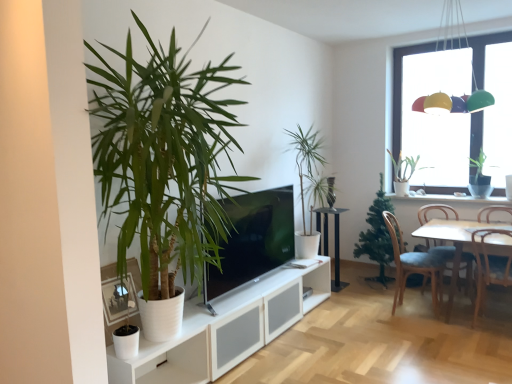
The width and height of the screenshot is (512, 384). Find the location of `transparent glass window at upper right`. transparent glass window at upper right is located at coordinates (440, 119).

Locate an element on the screen. The image size is (512, 384). green matte christmas tree at center, which ranks as the 3th houseplant in right-to-left order is located at coordinates (377, 236).

What is the approximate height of green matte christmas tree at center, placed as the 2th houseplant when sorted from back to front?

green matte christmas tree at center, placed as the 2th houseplant when sorted from back to front, is 1.22 meters tall.

What is the approximate width of blue fabric chair at lower right, which is the fourth chair from right to left?

blue fabric chair at lower right, which is the fourth chair from right to left, is 20.95 inches wide.

The image size is (512, 384). I want to click on green matte plant at upper right, which is counted as the first houseplant, starting from the right, so click(x=479, y=178).

Where is `white wooden table at right, which is the first table from right to left`? The image size is (512, 384). white wooden table at right, which is the first table from right to left is located at coordinates (454, 242).

From the image's perspective, does green matte plant at upper right, positioned as the fourth houseplant in left-to-right order, appear higher than multicolored plastic lampshade at upper right?

No.

Is point (396, 170) farther from camera compared to point (467, 101)?

Yes, point (396, 170) is behind point (467, 101).

Is green matte plant at upper right, the first houseplant when ordered from back to front, to the right of multicolored plastic lampshade at upper right from the viewer's perspective?

Indeed, green matte plant at upper right, the first houseplant when ordered from back to front, is positioned on the right side of multicolored plastic lampshade at upper right.

Considering the sizes of green matte plant at upper right, positioned as the second houseplant in right-to-left order, and multicolored plastic lampshade at upper right in the image, is green matte plant at upper right, positioned as the second houseplant in right-to-left order, wider or thinner than multicolored plastic lampshade at upper right?

Considering their sizes, green matte plant at upper right, positioned as the second houseplant in right-to-left order, looks slimmer than multicolored plastic lampshade at upper right.

From the image's perspective, does black metal table at center, the 1th table viewed from the back, appear lower than wooden chair at lower right, positioned as the 3th chair in left-to-right order?

No.

In terms of width, does black metal table at center, which appears as the 2th table when viewed from the front, look wider or thinner when compared to wooden chair at lower right, positioned as the 3th chair in left-to-right order?

Clearly, black metal table at center, which appears as the 2th table when viewed from the front, has less width compared to wooden chair at lower right, positioned as the 3th chair in left-to-right order.

How much distance is there between black metal table at center, the 1th table viewed from the back, and wooden chair at lower right, positioned as the 3th chair in left-to-right order?

The distance of black metal table at center, the 1th table viewed from the back, from wooden chair at lower right, positioned as the 3th chair in left-to-right order, is 1.38 meters.

Consider the image. Considering their positions, is black metal table at center, placed as the second table when sorted from right to left, located in front of or behind wooden chair at lower right, positioned as the 3th chair in left-to-right order?

black metal table at center, placed as the second table when sorted from right to left, is positioned farther from the viewer than wooden chair at lower right, positioned as the 3th chair in left-to-right order.

Is white wooden table at right, marked as the second table in a back-to-front arrangement, aimed at green leafy plant at center, arranged as the fourth houseplant when viewed from the back?

No, white wooden table at right, marked as the second table in a back-to-front arrangement, is not aimed at green leafy plant at center, arranged as the fourth houseplant when viewed from the back.

Which object is further away from the camera, white wooden table at right, which is the first table from right to left, or green leafy plant at center, acting as the 2th houseplant starting from the front?

Positioned behind is green leafy plant at center, acting as the 2th houseplant starting from the front.

How distant is white wooden table at right, which is the second table from left to right, from green leafy plant at center, arranged as the fourth houseplant when viewed from the back?

white wooden table at right, which is the second table from left to right, is 4.05 feet from green leafy plant at center, arranged as the fourth houseplant when viewed from the back.

From a real-world perspective, which is physically below, white wooden table at right, which is the first table from right to left, or green leafy plant at center, which appears as the second houseplant when viewed from the left?

From a 3D spatial view, white wooden table at right, which is the first table from right to left, is below.

Is the surface of white wooden table at right, which is the 1th table in front-to-back order, in direct contact with white ceramic window sill at upper right?

white wooden table at right, which is the 1th table in front-to-back order, and white ceramic window sill at upper right are not in contact.

Is white wooden table at right, which is the first table from right to left, not within white ceramic window sill at upper right?

Yes, white wooden table at right, which is the first table from right to left, is outside of white ceramic window sill at upper right.

Which object is more forward, white wooden table at right, which is the second table from left to right, or white ceramic window sill at upper right?

white wooden table at right, which is the second table from left to right.

Is white wooden table at right, which is the 1th table in front-to-back order, bigger or smaller than white ceramic window sill at upper right?

In the image, white wooden table at right, which is the 1th table in front-to-back order, appears to be larger than white ceramic window sill at upper right.

From the image's perspective, is green leafy plant at left, which ranks as the 1th houseplant in left-to-right order, located above or below blue fabric chair at lower right, which is the fourth chair from right to left?

Clearly, from the image's perspective, green leafy plant at left, which ranks as the 1th houseplant in left-to-right order, is above blue fabric chair at lower right, which is the fourth chair from right to left.

Visually, is green leafy plant at left, which ranks as the 1th houseplant in left-to-right order, positioned to the left or to the right of blue fabric chair at lower right, which is the fourth chair from right to left?

green leafy plant at left, which ranks as the 1th houseplant in left-to-right order, is to the left of blue fabric chair at lower right, which is the fourth chair from right to left.

Which of these two, green leafy plant at left, the first houseplant when ordered from front to back, or blue fabric chair at lower right, which ranks as the 1th chair in left-to-right order, is smaller?

With smaller size is blue fabric chair at lower right, which ranks as the 1th chair in left-to-right order.

Considering the positions of points (175, 54) and (393, 243), is point (175, 54) farther from camera compared to point (393, 243)?

That is False.

Is point (488, 202) closer or farther from the camera than point (399, 192)?

Point (488, 202) is closer to the camera than point (399, 192).

Does white ceramic window sill at upper right lie behind green matte plant at upper right, positioned as the second houseplant in right-to-left order?

No.

How much distance is there between white ceramic window sill at upper right and green matte plant at upper right, which is the 5th houseplant in front-to-back order?

white ceramic window sill at upper right and green matte plant at upper right, which is the 5th houseplant in front-to-back order, are 16.60 inches apart.

From a real-world perspective, which object rests below the other?

From a 3D spatial view, white ceramic window sill at upper right is below.

Which of these two, blue fabric chair at lower right, which ranks as the 1th chair in left-to-right order, or wooden chair at right, acting as the third chair starting from the right, is bigger?

With larger size is blue fabric chair at lower right, which ranks as the 1th chair in left-to-right order.

Between blue fabric chair at lower right, which is the fourth chair from right to left, and wooden chair at right, which is the second chair from left to right, which one has less height?

Standing shorter between the two is wooden chair at right, which is the second chair from left to right.

Is blue fabric chair at lower right, which ranks as the 1th chair in left-to-right order, facing away from wooden chair at right, acting as the third chair starting from the right?

No.

From a real-world perspective, is blue fabric chair at lower right, which is the fourth chair from right to left, positioned under wooden chair at right, which is the second chair from left to right, based on gravity?

Yes, from a real-world perspective, blue fabric chair at lower right, which is the fourth chair from right to left, is under wooden chair at right, which is the second chair from left to right.

I want to click on the 4th houseplant behind when counting from the multicolored plastic lampshade at upper right, so click(404, 172).

The width and height of the screenshot is (512, 384). What are the coordinates of `the 4th chair in front of the black metal table at center, the 1th table viewed from the back` in the screenshot? It's located at (490, 265).

Looking at the image, which one is located closer to green matte christmas tree at center, which ranks as the 3th houseplant in right-to-left order, green leafy plant at center, acting as the 2th houseplant starting from the front, or green matte plant at upper right, placed as the 3th houseplant when sorted from front to back?

The object closer to green matte christmas tree at center, which ranks as the 3th houseplant in right-to-left order, is green leafy plant at center, acting as the 2th houseplant starting from the front.

From the image, which object appears to be farther from transparent glass window at upper right, green leafy plant at center, marked as the 4th houseplant in a right-to-left arrangement, or matte black tv at center?

Based on the image, matte black tv at center appears to be further to transparent glass window at upper right.

Looking at the image, which one is located closer to wooden chair at right, acting as the third chair starting from the right, green matte christmas tree at center, the 3th houseplant from the left, or transparent glass window at upper right?

The object closer to wooden chair at right, acting as the third chair starting from the right, is green matte christmas tree at center, the 3th houseplant from the left.

Considering their positions, is green leafy plant at left, which ranks as the 1th houseplant in left-to-right order, positioned further to wooden chair at right, acting as the third chair starting from the right, than transparent glass window at upper right?

green leafy plant at left, which ranks as the 1th houseplant in left-to-right order, is further to wooden chair at right, acting as the third chair starting from the right.

Looking at the image, which one is located further to green matte plant at upper right, marked as the third houseplant in a back-to-front arrangement, black metal table at center, placed as the second table when sorted from right to left, or blue fabric chair at lower right, which ranks as the 1th chair in left-to-right order?

black metal table at center, placed as the second table when sorted from right to left, is positioned further to the anchor green matte plant at upper right, marked as the third houseplant in a back-to-front arrangement.

From the image, which object appears to be nearer to white wooden table at right, which is the 1th table in front-to-back order, transparent glass window at upper right or green matte plant at upper right, which is the 5th houseplant in front-to-back order?

Based on the image, green matte plant at upper right, which is the 5th houseplant in front-to-back order, appears to be nearer to white wooden table at right, which is the 1th table in front-to-back order.

Based on their spatial positions, is green matte christmas tree at center, placed as the 2th houseplant when sorted from back to front, or transparent glass window at upper right closer to blue fabric chair at lower right, which ranks as the 1th chair in left-to-right order?

Among the two, green matte christmas tree at center, placed as the 2th houseplant when sorted from back to front, is located nearer to blue fabric chair at lower right, which ranks as the 1th chair in left-to-right order.

Which object lies nearer to the anchor point transparent glass window at upper right, green leafy plant at center, marked as the 4th houseplant in a right-to-left arrangement, or green matte plant at upper right, positioned as the 5th houseplant in left-to-right order?

green matte plant at upper right, positioned as the 5th houseplant in left-to-right order.

You are a GUI agent. You are given a task and a screenshot of the screen. Output one action in this format:
    pyautogui.click(x=<x>, y=<y>)
    Task: Click on the chair between multicolored plastic lampshade at upper right and brown wooden chair at right, marked as the 1th chair in a right-to-left arrangement, in the vertical direction
    
    Given the screenshot: What is the action you would take?
    [436, 213]

You are a GUI agent. You are given a task and a screenshot of the screen. Output one action in this format:
    pyautogui.click(x=<x>, y=<y>)
    Task: Click on the lamp located between green leafy plant at left, acting as the fifth houseplant starting from the right, and black metal table at center, which is the first table in left-to-right order, in the depth direction
    This screenshot has width=512, height=384.
    Given the screenshot: What is the action you would take?
    pyautogui.click(x=454, y=102)

I want to click on table located between black metal table at center, placed as the second table when sorted from right to left, and green matte plant at upper right, marked as the third houseplant in a back-to-front arrangement, in the left-right direction, so click(454, 242).

Where is `chair between green matte plant at upper right, positioned as the fourth houseplant in left-to-right order, and brown wooden chair at right, the fourth chair positioned from the left, from top to bottom`? chair between green matte plant at upper right, positioned as the fourth houseplant in left-to-right order, and brown wooden chair at right, the fourth chair positioned from the left, from top to bottom is located at coordinates (436, 213).